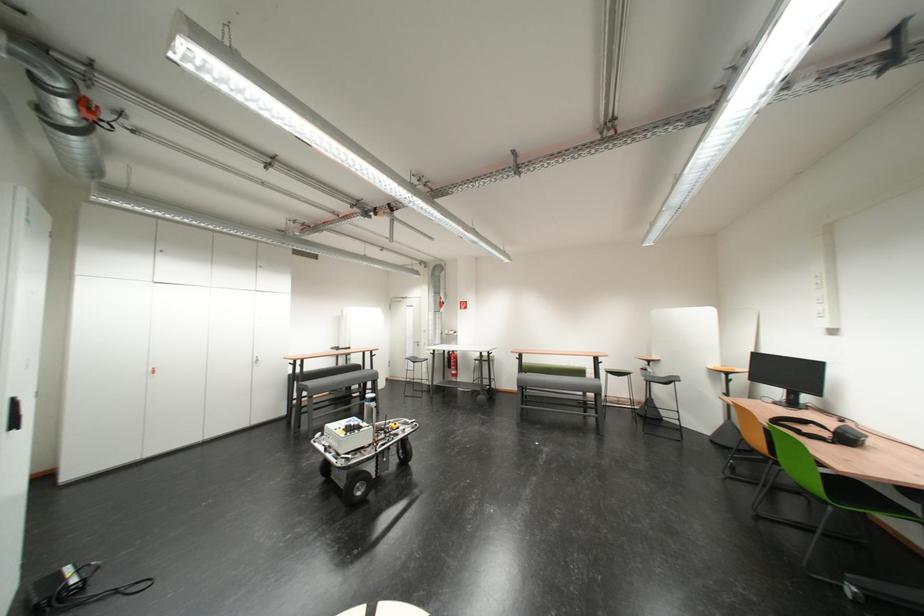
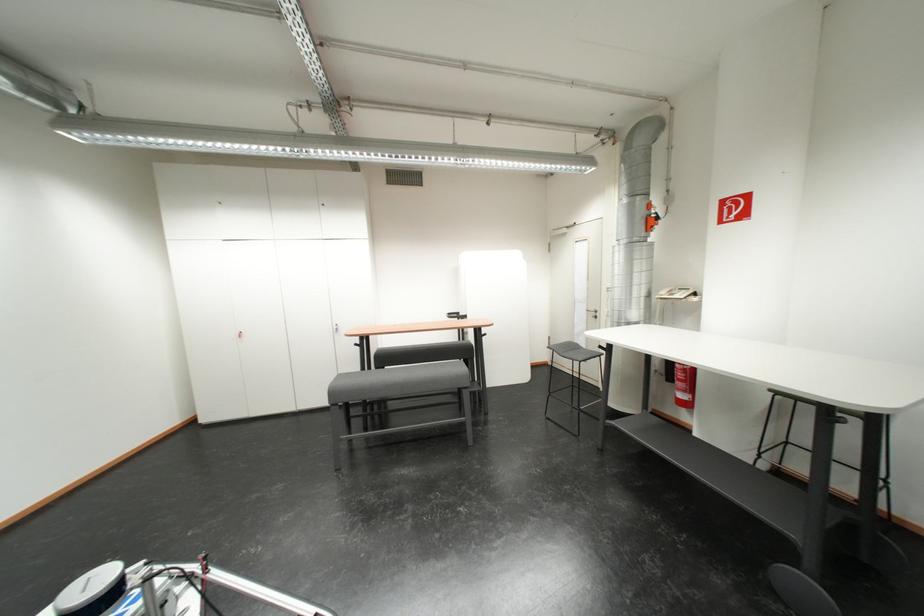
The point at [457,334] is marked in the first image. Where is the corresponding point in the second image?

(675, 296)